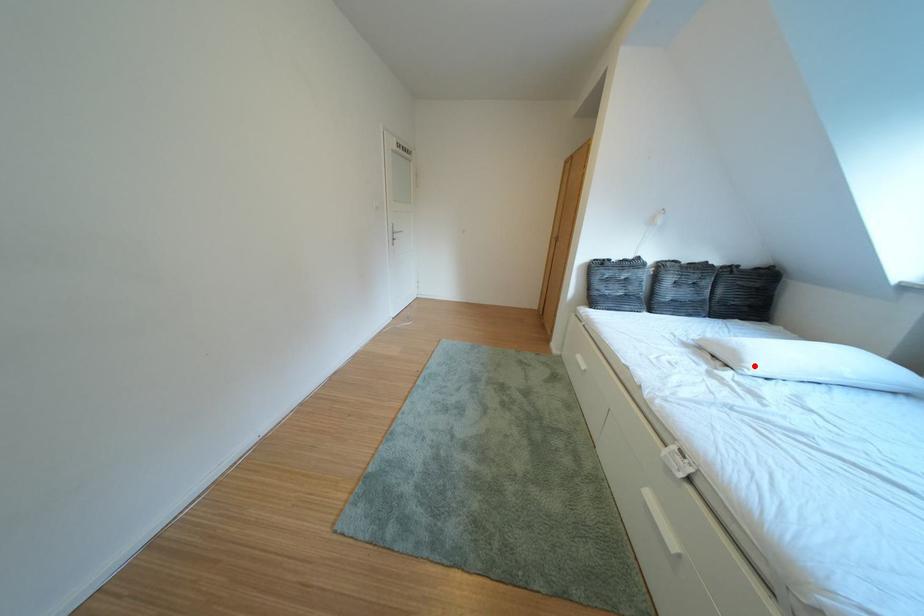
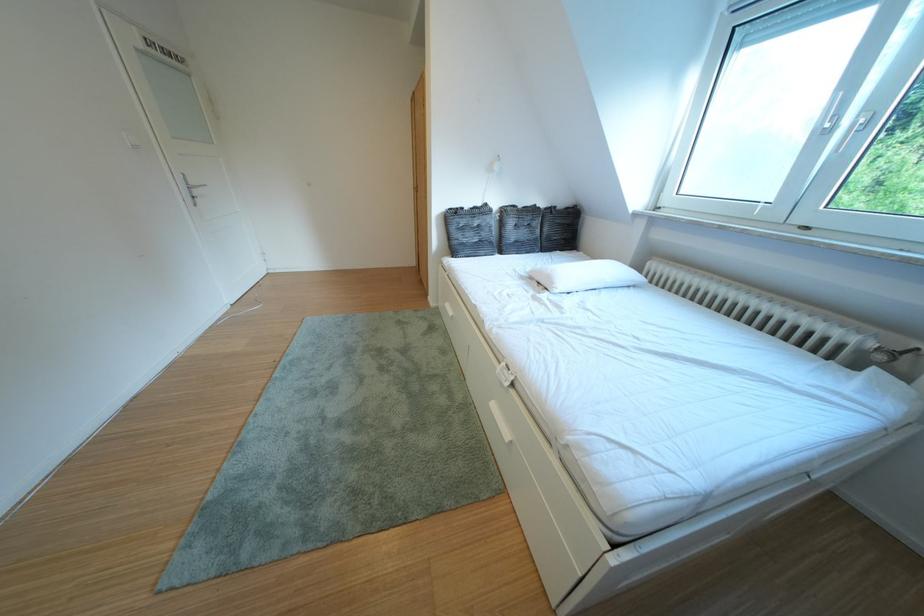
In the second image, find the point that corresponds to the highlighted location in the first image.

(565, 288)